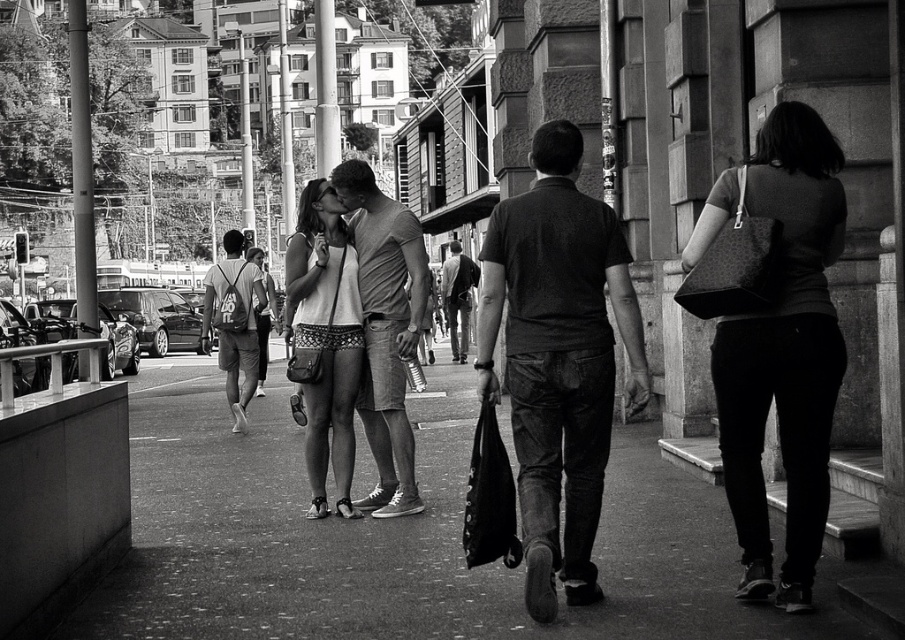
Question: Is matte black bag at center to the left of dark gray shirt at center from the viewer's perspective?

Choices:
 (A) no
 (B) yes

Answer: (A)

Question: Which object is farther from the camera taking this photo?

Choices:
 (A) matte gray t-shirt at center
 (B) matte gray shirt at center
 (C) matte gray backpack at center
 (D) dark gray shirt at center

Answer: (B)

Question: Is smooth concrete pavement at center smaller than matte black bag at center?

Choices:
 (A) no
 (B) yes

Answer: (A)

Question: Which of the following is the closest to the observer?

Choices:
 (A) matte gray backpack at center
 (B) smooth concrete pavement at center
 (C) matte white tank top at center
 (D) dark gray shirt at center

Answer: (B)

Question: Considering the relative positions of matte gray backpack at center and matte gray shirt at center in the image provided, where is matte gray backpack at center located with respect to matte gray shirt at center?

Choices:
 (A) below
 (B) above

Answer: (A)

Question: Among these objects, which one is nearest to the camera?

Choices:
 (A) smooth concrete pavement at center
 (B) matte gray backpack at center
 (C) matte gray shirt at center
 (D) matte white tank top at center

Answer: (A)